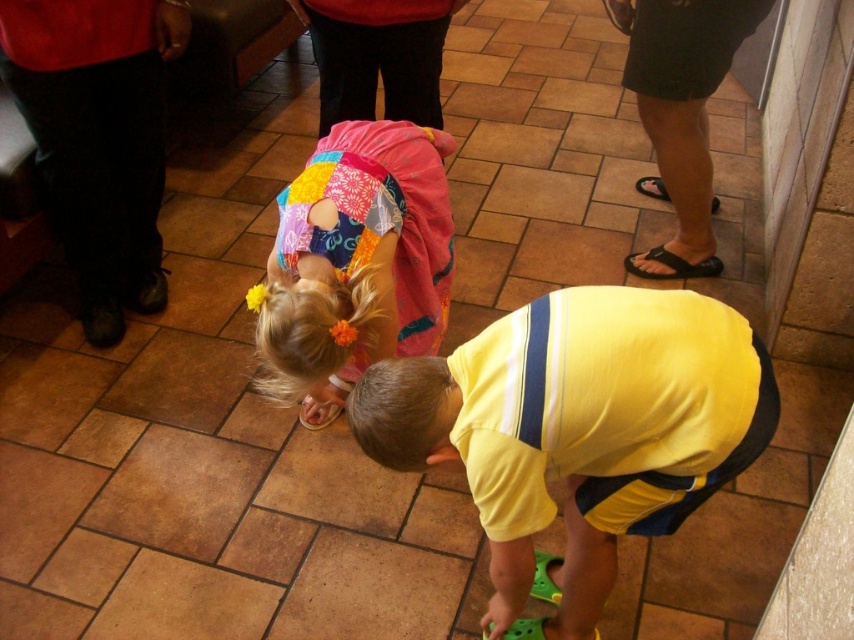
Which is more to the left, yellow cotton shirt at lower center or patchwork fabric dress at center?

Positioned to the left is patchwork fabric dress at center.

Is yellow cotton shirt at lower center positioned at the back of patchwork fabric dress at center?

No, it is in front of patchwork fabric dress at center.

Between point (439, 380) and point (396, 332), which one is positioned in front?

Positioned in front is point (439, 380).

The width and height of the screenshot is (854, 640). Find the location of `yellow cotton shirt at lower center`. yellow cotton shirt at lower center is located at coordinates (578, 429).